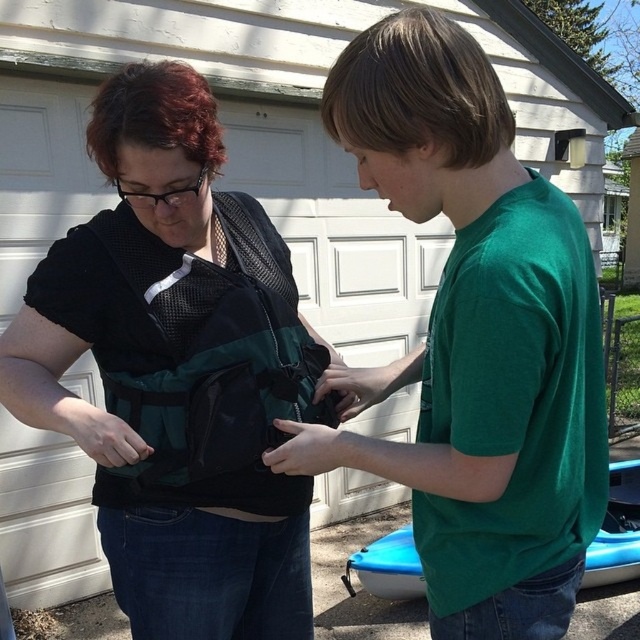
Question: Does matte black vest at center appear under blue plastic kayak at lower right?

Choices:
 (A) no
 (B) yes

Answer: (A)

Question: Which point is farther to the camera?

Choices:
 (A) matte black vest at center
 (B) green matte shirt at center

Answer: (A)

Question: Can you confirm if matte black vest at center is smaller than green matte shirt at center?

Choices:
 (A) yes
 (B) no

Answer: (B)

Question: Which of the following is the closest to the observer?

Choices:
 (A) (627, 561)
 (B) (484, 312)
 (C) (140, 454)

Answer: (B)

Question: Is green matte shirt at center thinner than blue plastic kayak at lower right?

Choices:
 (A) no
 (B) yes

Answer: (A)

Question: Based on their relative distances, which object is farther from the blue plastic kayak at lower right?

Choices:
 (A) green matte shirt at center
 (B) matte black vest at center

Answer: (B)